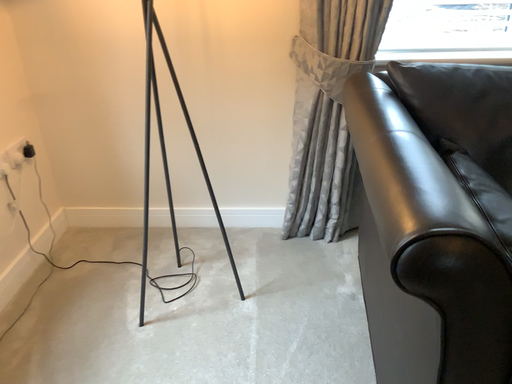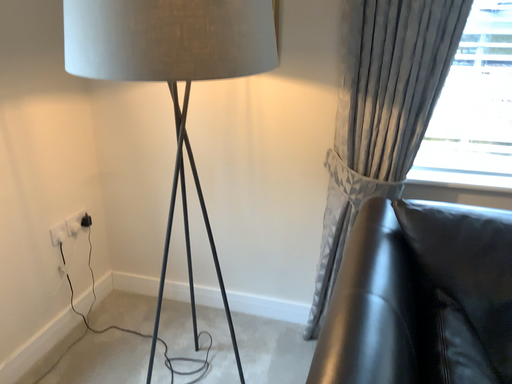
Question: How did the camera likely rotate when shooting the video?

Choices:
 (A) rotated upward
 (B) rotated downward

Answer: (A)